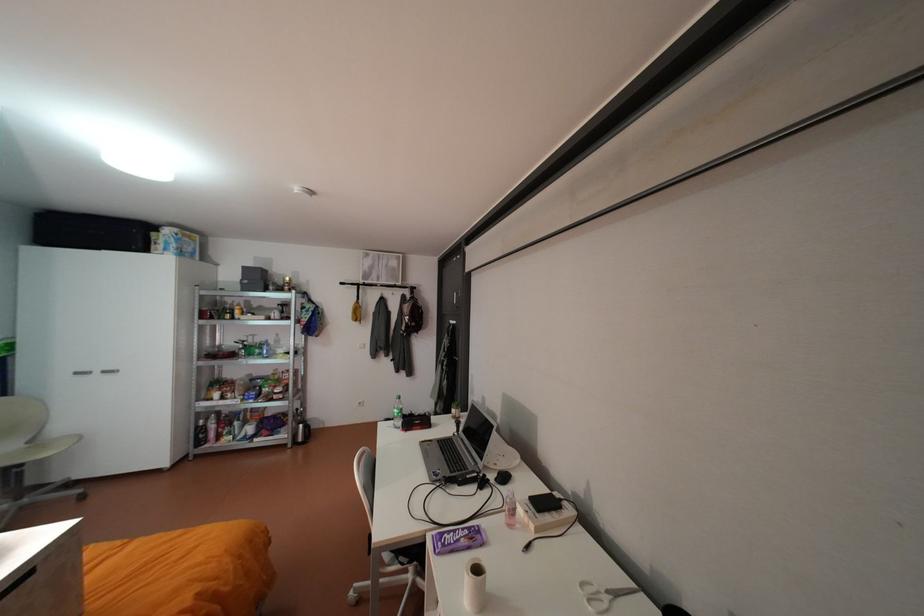
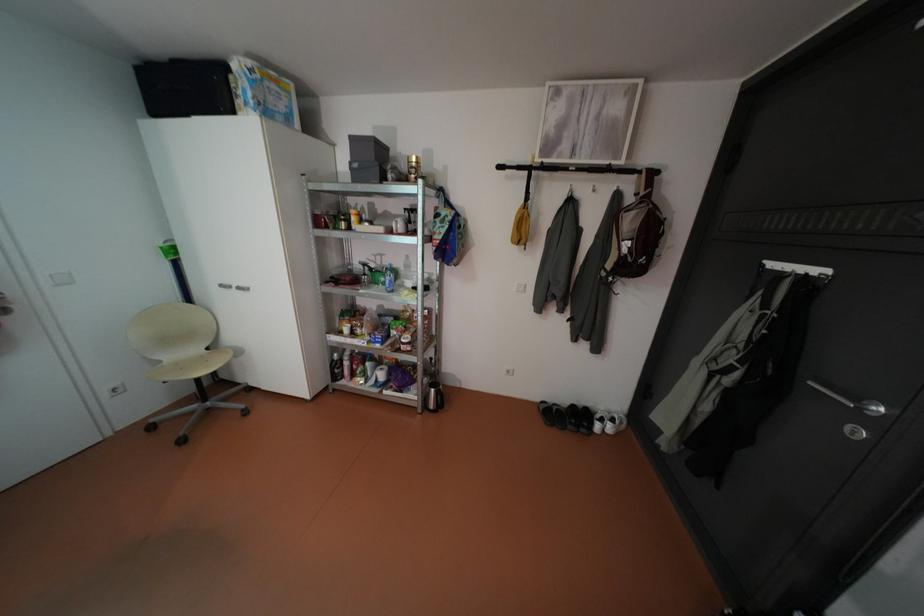
In the second image, find the point that corresponds to the point at 258,354 in the first image.

(383, 282)